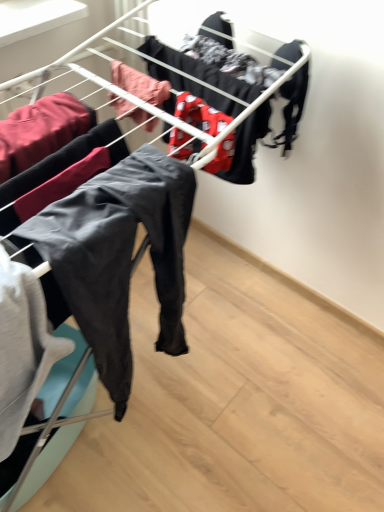
Question: Should I look upward or downward to see red fabric with white patterns at center, marked as the second clothing in a right-to-left arrangement?

Choices:
 (A) down
 (B) up

Answer: (B)

Question: Considering the relative positions of matte black pants at left, the 1th clothing positioned from the left, and red fabric with white patterns at center, positioned as the 4th clothing in left-to-right order, in the image provided, is matte black pants at left, the 1th clothing positioned from the left, in front of red fabric with white patterns at center, positioned as the 4th clothing in left-to-right order,?

Choices:
 (A) yes
 (B) no

Answer: (A)

Question: Is matte black pants at left, the 5th clothing positioned from the right, aimed at red fabric with white patterns at center, marked as the second clothing in a right-to-left arrangement?

Choices:
 (A) no
 (B) yes

Answer: (A)

Question: Is matte black pants at left, the 1th clothing positioned from the left, located outside red fabric with white patterns at center, positioned as the 4th clothing in left-to-right order?

Choices:
 (A) no
 (B) yes

Answer: (B)

Question: Considering the relative sizes of matte black pants at left, the 1th clothing positioned from the left, and red fabric with white patterns at center, positioned as the 4th clothing in left-to-right order, in the image provided, is matte black pants at left, the 1th clothing positioned from the left, wider than red fabric with white patterns at center, positioned as the 4th clothing in left-to-right order,?

Choices:
 (A) yes
 (B) no

Answer: (A)

Question: Does matte black pants at left, the 1th clothing positioned from the left, have a smaller size compared to red fabric with white patterns at center, positioned as the 4th clothing in left-to-right order?

Choices:
 (A) yes
 (B) no

Answer: (B)

Question: From a real-world perspective, is matte black pants at left, the 1th clothing positioned from the left, beneath red fabric with white patterns at center, marked as the second clothing in a right-to-left arrangement?

Choices:
 (A) no
 (B) yes

Answer: (B)

Question: Is matte black pants at left, the 5th clothing positioned from the right, at the left side of black matte underwear at upper right, the 5th clothing from the left?

Choices:
 (A) yes
 (B) no

Answer: (A)

Question: Is matte black pants at left, the 1th clothing positioned from the left, closer to the viewer compared to black matte underwear at upper right, the 5th clothing from the left?

Choices:
 (A) yes
 (B) no

Answer: (A)

Question: Would you say matte black pants at left, the 1th clothing positioned from the left, contains black matte underwear at upper right, the first clothing in the right-to-left sequence?

Choices:
 (A) yes
 (B) no

Answer: (B)

Question: Does matte black pants at left, the 1th clothing positioned from the left, turn towards black matte underwear at upper right, the 5th clothing from the left?

Choices:
 (A) yes
 (B) no

Answer: (B)

Question: Is matte black pants at left, the 1th clothing positioned from the left, placed right next to black matte underwear at upper right, the 5th clothing from the left?

Choices:
 (A) no
 (B) yes

Answer: (A)

Question: From the image's perspective, is matte black pants at left, the 5th clothing positioned from the right, under black matte underwear at upper right, the 5th clothing from the left?

Choices:
 (A) no
 (B) yes

Answer: (B)

Question: Is matte black pants at center, positioned as the fourth clothing in right-to-left order, to the right of matte black pants at left, the 5th clothing positioned from the right, from the viewer's perspective?

Choices:
 (A) yes
 (B) no

Answer: (A)